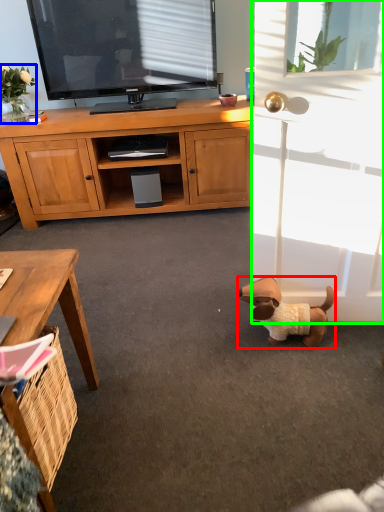
Question: Considering the real-world distances, which object is farthest from dog (highlighted by a red box)? flower (highlighted by a blue box) or screen door (highlighted by a green box)?

Choices:
 (A) flower
 (B) screen door

Answer: (A)